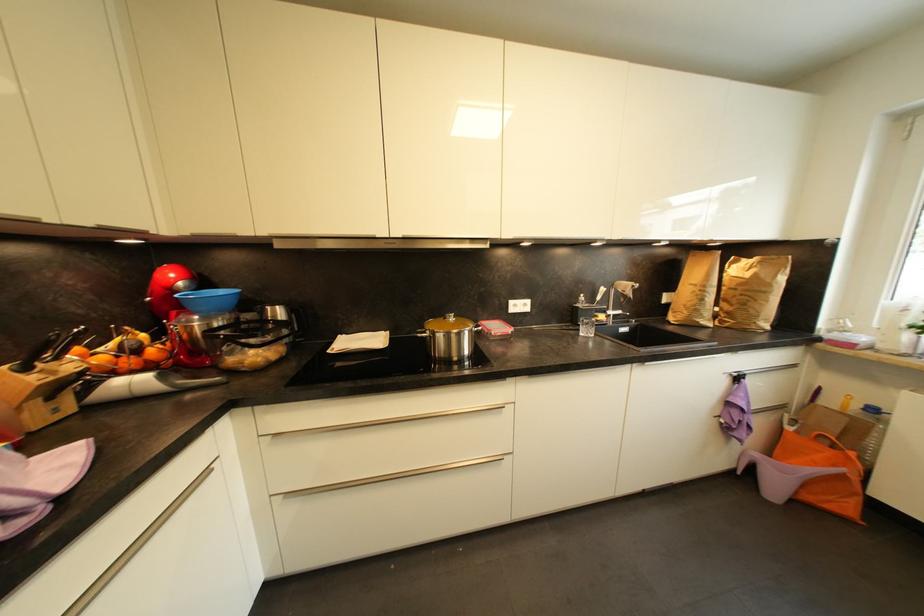
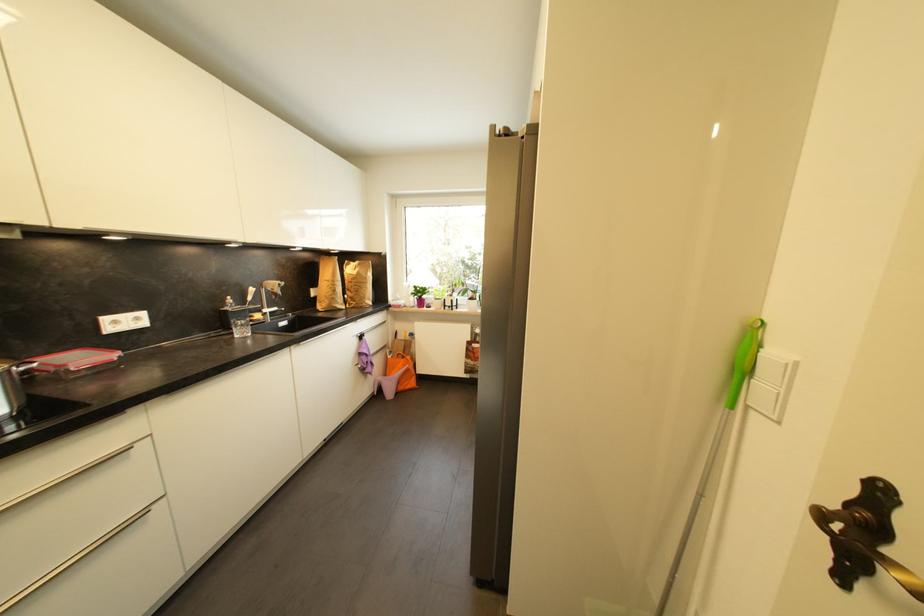
Question: The images are taken continuously from a first-person perspective. In which direction is your viewpoint rotating?

Choices:
 (A) Left
 (B) Right
 (C) Up
 (D) Down

Answer: (B)